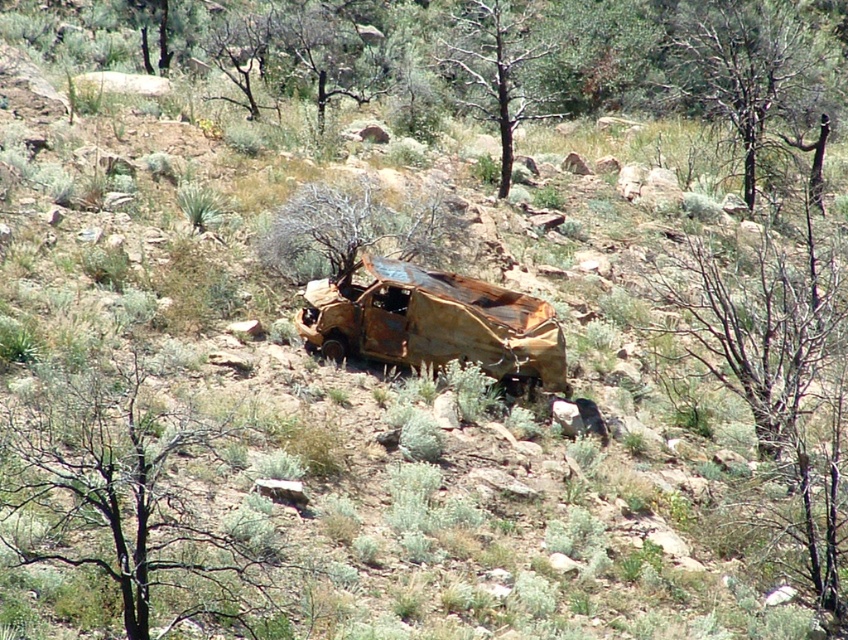
Question: Which object is closer to the camera taking this photo?

Choices:
 (A) rusty metal vehicle at center
 (B) brown bark tree at center
 (C) brown bark tree at upper right

Answer: (A)

Question: Can you confirm if brown dry wood at center is positioned to the left of brown bark tree at center?

Choices:
 (A) no
 (B) yes

Answer: (B)

Question: Is charred wood tree at center positioned at the back of brown bark tree at upper right?

Choices:
 (A) yes
 (B) no

Answer: (B)

Question: Is charred wood tree at center bigger than brown bark tree at center?

Choices:
 (A) no
 (B) yes

Answer: (A)

Question: Estimate the real-world distances between objects in this image. Which object is closer to the charred wood tree at center?

Choices:
 (A) brown bark tree at upper right
 (B) brown dry wood at center

Answer: (B)

Question: Which object is farther from the camera taking this photo?

Choices:
 (A) brown dry wood at center
 (B) brown bark tree at center

Answer: (B)